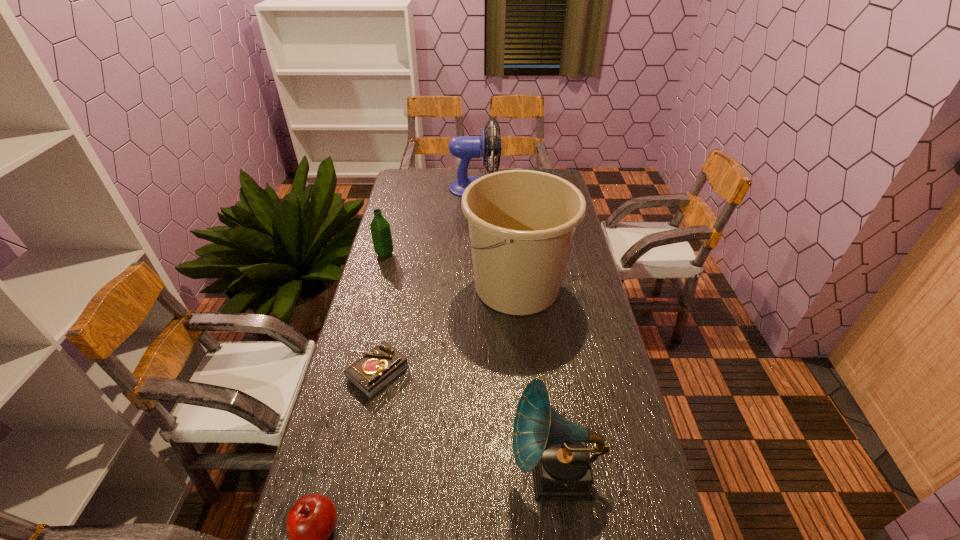
You are a GUI agent. You are given a task and a screenshot of the screen. Output one action in this format:
    pyautogui.click(x=<x>, y=<y>)
    Task: Click on the vacant space located from the horn of the phonograph_record
    This screenshot has height=540, width=960.
    Given the screenshot: What is the action you would take?
    pyautogui.click(x=383, y=472)

Identify the location of vacant space located 0.200m on the back of the water bottle. The image size is (960, 540). (394, 220).

Locate an element on the screen. The height and width of the screenshot is (540, 960). free space located on the right of the shortest object is located at coordinates (493, 372).

Where is `object at the far edge`? object at the far edge is located at coordinates (464, 147).

This screenshot has width=960, height=540. I want to click on water bottle present at the left edge, so click(x=380, y=229).

This screenshot has width=960, height=540. In order to click on diary situated at the left edge in this screenshot , I will do `click(377, 368)`.

Identify the location of bucket at the right edge. The image size is (960, 540). (522, 223).

The image size is (960, 540). I want to click on phonograph_record positioned at the right edge, so click(555, 448).

This screenshot has height=540, width=960. In the image, there is a desktop. What are the coordinates of `vacant space at the far edge` in the screenshot? It's located at (457, 176).

Image resolution: width=960 pixels, height=540 pixels. What are the coordinates of `vacant space at the left edge of the desktop` in the screenshot? It's located at (409, 245).